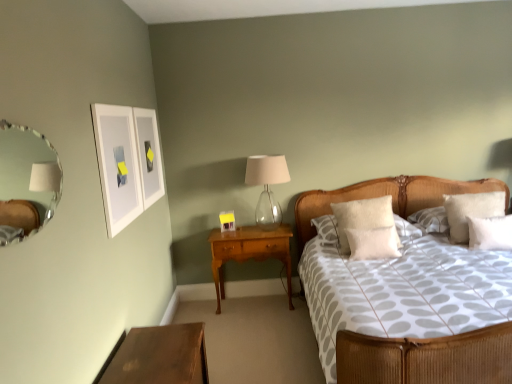
You are a GUI agent. You are given a task and a screenshot of the screen. Output one action in this format:
    pyautogui.click(x=<x>, y=<y>)
    Task: Click on the vacant area that lies in front of wooden nightstand at center, placed as the 1th nightstand when sorted from back to front
    The image size is (512, 384).
    Given the screenshot: What is the action you would take?
    pyautogui.click(x=260, y=327)